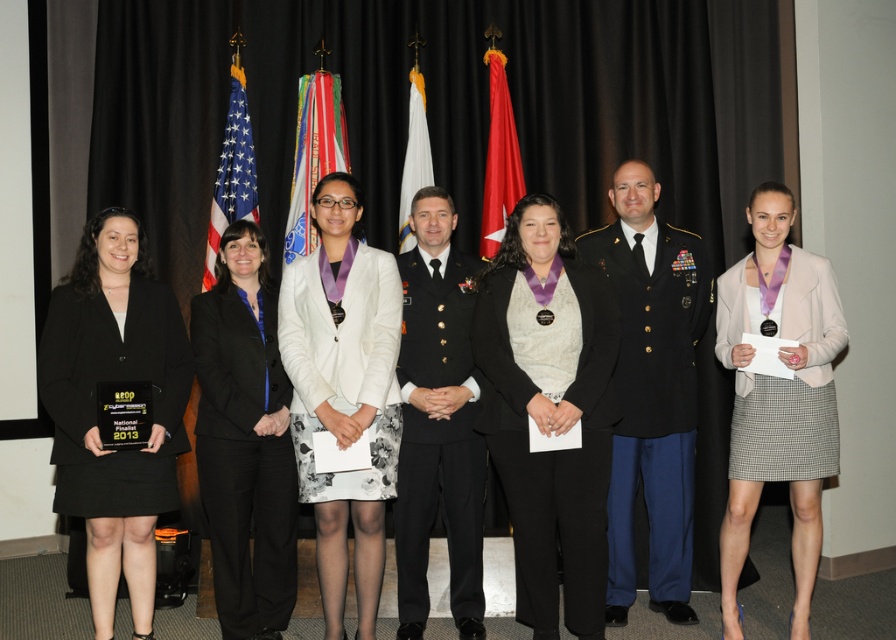
Question: Is silky fabric flag at center thinner than red fabric flag at center?

Choices:
 (A) no
 (B) yes

Answer: (A)

Question: Considering the real-world distances, which object is closest to the black wool suit at center?

Choices:
 (A) shiny black uniform at center
 (B) light beige wool jacket at center

Answer: (A)

Question: Is dark blue military uniform at center bigger than shiny black uniform at center?

Choices:
 (A) yes
 (B) no

Answer: (A)

Question: Estimate the real-world distances between objects in this image. Which object is closer to the dark blue military uniform at center?

Choices:
 (A) silky fabric flag at center
 (B) white fabric flag at center
 (C) white satin blazer at center

Answer: (C)

Question: Which point is farther to the camera?

Choices:
 (A) shiny black uniform at center
 (B) red fabric flag at center
 (C) light beige wool jacket at center
 (D) white satin blazer at center

Answer: (B)

Question: Is light beige wool jacket at center wider than shiny black uniform at center?

Choices:
 (A) no
 (B) yes

Answer: (B)